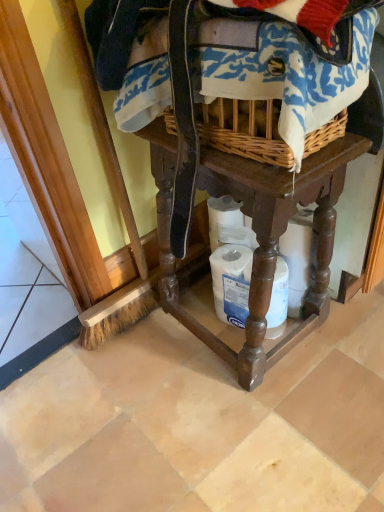
Question: Can you confirm if white matte toilet paper at lower center is positioned to the right of woven fabric at upper center?

Choices:
 (A) yes
 (B) no

Answer: (A)

Question: Can you confirm if white matte toilet paper at lower center is taller than woven fabric at upper center?

Choices:
 (A) yes
 (B) no

Answer: (A)

Question: From the image's perspective, does white matte toilet paper at lower center appear lower than woven fabric at upper center?

Choices:
 (A) yes
 (B) no

Answer: (A)

Question: From a real-world perspective, does white matte toilet paper at lower center stand above woven fabric at upper center?

Choices:
 (A) no
 (B) yes

Answer: (A)

Question: From the image's perspective, is white matte toilet paper at lower center located above woven fabric at upper center?

Choices:
 (A) no
 (B) yes

Answer: (A)

Question: Is white matte toilet paper at lower center positioned in front of woven fabric at upper center?

Choices:
 (A) no
 (B) yes

Answer: (A)

Question: Is brown wooden table at center thinner than woven fabric at upper center?

Choices:
 (A) yes
 (B) no

Answer: (A)

Question: From a real-world perspective, is brown wooden table at center on woven fabric at upper center?

Choices:
 (A) no
 (B) yes

Answer: (A)

Question: Is brown wooden table at center beside woven fabric at upper center?

Choices:
 (A) no
 (B) yes

Answer: (A)

Question: From a real-world perspective, is brown wooden table at center beneath woven fabric at upper center?

Choices:
 (A) no
 (B) yes

Answer: (B)

Question: Is brown wooden table at center outside woven fabric at upper center?

Choices:
 (A) yes
 (B) no

Answer: (A)

Question: Can you confirm if brown wooden table at center is bigger than woven fabric at upper center?

Choices:
 (A) no
 (B) yes

Answer: (B)

Question: Is white matte toilet paper at lower center taller than brown wooden table at center?

Choices:
 (A) yes
 (B) no

Answer: (B)